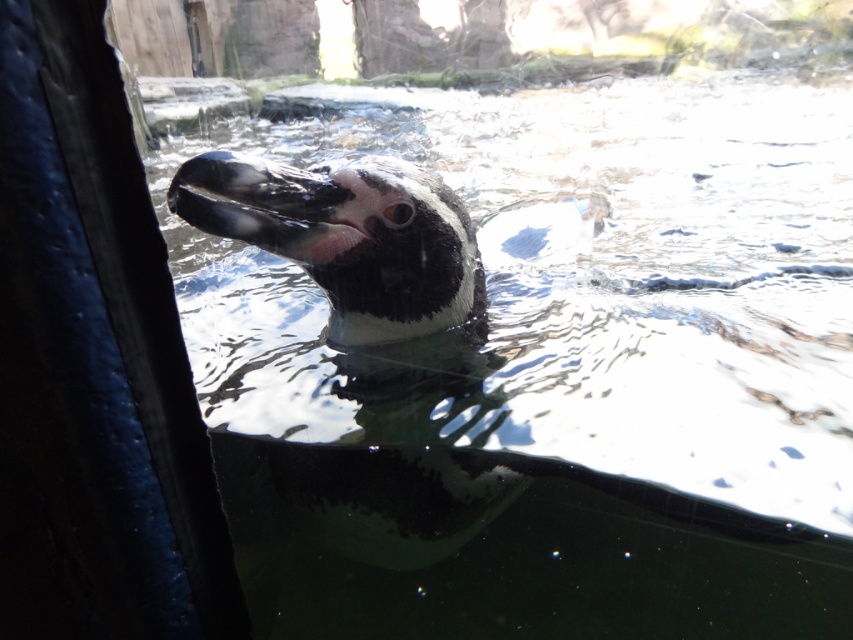
You are standing in front of the penguin enclosure and want to know how far the point at coordinates point (675, 282) is from you. Can you determine the distance?

The distance of point (675, 282) from viewer is 7.17 feet.

You are a zookeeper observing the penguin enclosure. You notice the clear water at center and the black matte penguin at center. Which object occupies a greater vertical space in the image?

The clear water at center is much taller than the black matte penguin at center, so it occupies a greater vertical space in the image.